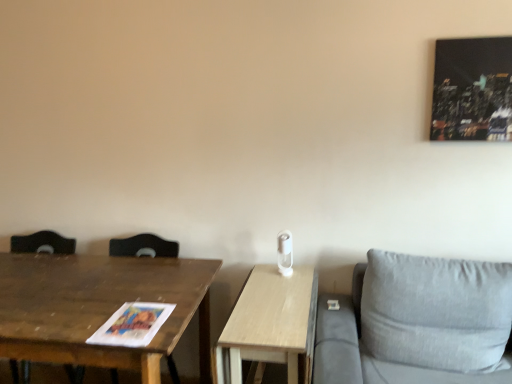
Question: Does wooden table at left, placed as the 2th table when sorted from right to left, lie in front of brown wooden swivel chair at left?

Choices:
 (A) yes
 (B) no

Answer: (A)

Question: From the image's perspective, is wooden table at left, marked as the first table in a left-to-right arrangement, above brown wooden swivel chair at left?

Choices:
 (A) yes
 (B) no

Answer: (B)

Question: Can you confirm if wooden table at left, placed as the 2th table when sorted from right to left, is thinner than brown wooden swivel chair at left?

Choices:
 (A) yes
 (B) no

Answer: (B)

Question: Considering the relative positions of wooden table at left, placed as the 2th table when sorted from right to left, and brown wooden swivel chair at left in the image provided, is wooden table at left, placed as the 2th table when sorted from right to left, behind brown wooden swivel chair at left?

Choices:
 (A) no
 (B) yes

Answer: (A)

Question: Considering the relative sizes of wooden table at left, placed as the 2th table when sorted from right to left, and brown wooden swivel chair at left in the image provided, is wooden table at left, placed as the 2th table when sorted from right to left, bigger than brown wooden swivel chair at left?

Choices:
 (A) no
 (B) yes

Answer: (B)

Question: Is wooden table at left, placed as the 2th table when sorted from right to left, smaller than brown wooden swivel chair at left?

Choices:
 (A) yes
 (B) no

Answer: (B)

Question: Does brown wooden swivel chair at left lie in front of wooden table at center, marked as the first table in a right-to-left arrangement?

Choices:
 (A) yes
 (B) no

Answer: (B)

Question: Is brown wooden swivel chair at left thinner than wooden table at center, the second table when ordered from left to right?

Choices:
 (A) yes
 (B) no

Answer: (A)

Question: Is brown wooden swivel chair at left facing towards wooden table at center, the second table when ordered from left to right?

Choices:
 (A) yes
 (B) no

Answer: (B)

Question: Is brown wooden swivel chair at left far from wooden table at center, marked as the first table in a right-to-left arrangement?

Choices:
 (A) yes
 (B) no

Answer: (A)

Question: From a real-world perspective, is brown wooden swivel chair at left physically below wooden table at center, the second table when ordered from left to right?

Choices:
 (A) no
 (B) yes

Answer: (A)

Question: Can you confirm if brown wooden swivel chair at left is wider than wooden table at center, marked as the first table in a right-to-left arrangement?

Choices:
 (A) no
 (B) yes

Answer: (A)

Question: Can wooden table at left, placed as the 2th table when sorted from right to left, be found inside wooden table at center, marked as the first table in a right-to-left arrangement?

Choices:
 (A) no
 (B) yes

Answer: (A)